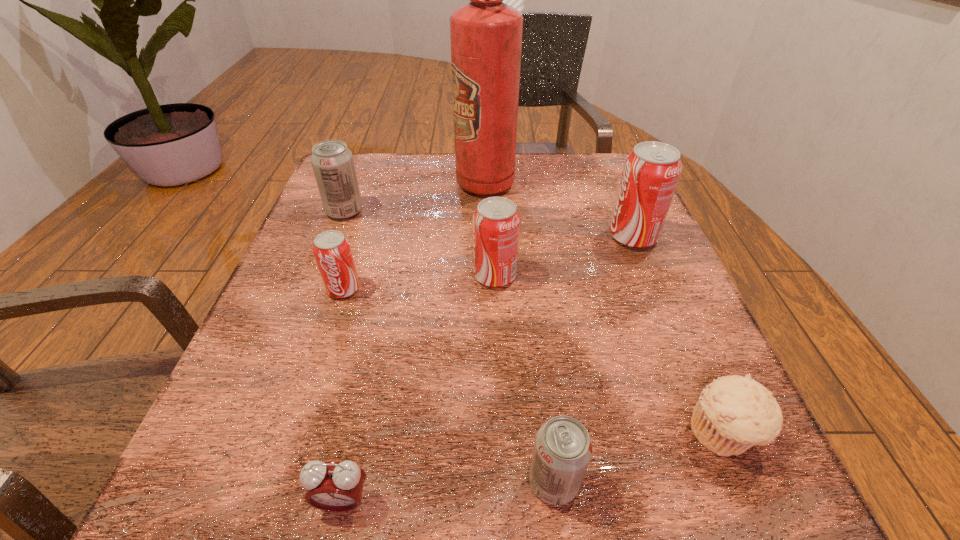
You are a GUI agent. You are given a task and a screenshot of the screen. Output one action in this format:
    pyautogui.click(x=<x>, y=<y>)
    Task: Click on the free space that satisfies the following two spatial constraints: 1. on the label side of the farthest object; 2. on the back side of the beige muffin
    This screenshot has width=960, height=540.
    Given the screenshot: What is the action you would take?
    pyautogui.click(x=489, y=433)

Find the location of a particular element. vacant region that satisfies the following two spatial constraints: 1. on the logo side of the muffin; 2. on the right side of the smallest red soda can is located at coordinates (297, 433).